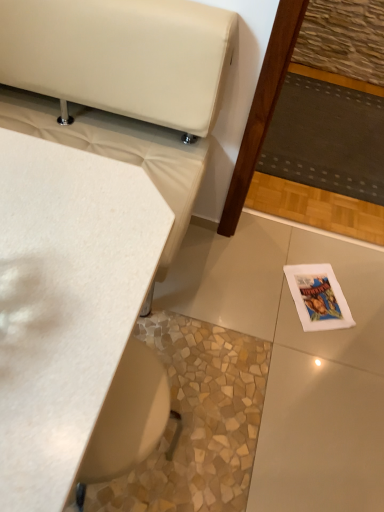
You are a GUI agent. You are given a task and a screenshot of the screen. Output one action in this format:
    pyautogui.click(x=<x>, y=<y>)
    Task: Click on the blank area beneath white paper magazine at lower right (from a real-world perspective)
    The image size is (384, 512).
    Given the screenshot: What is the action you would take?
    pyautogui.click(x=321, y=295)